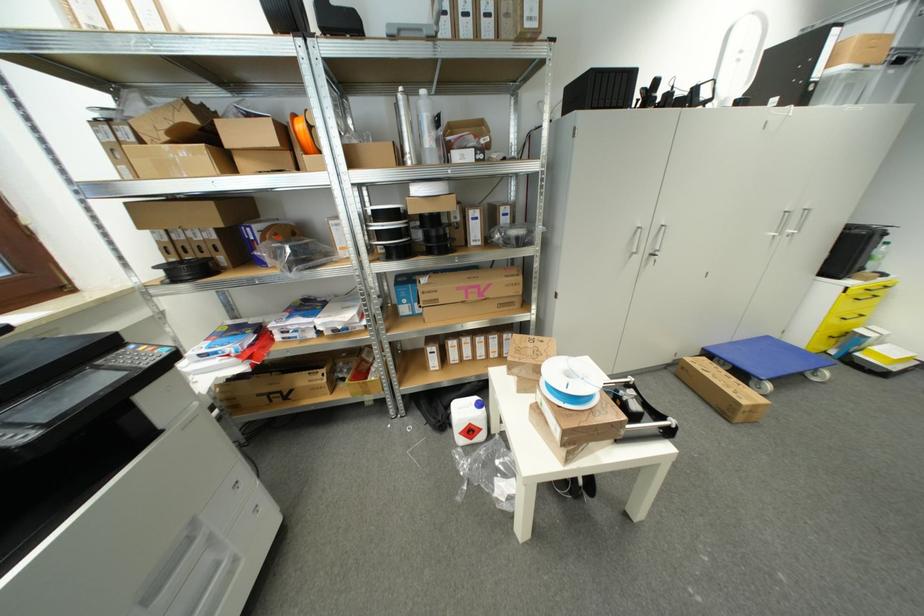
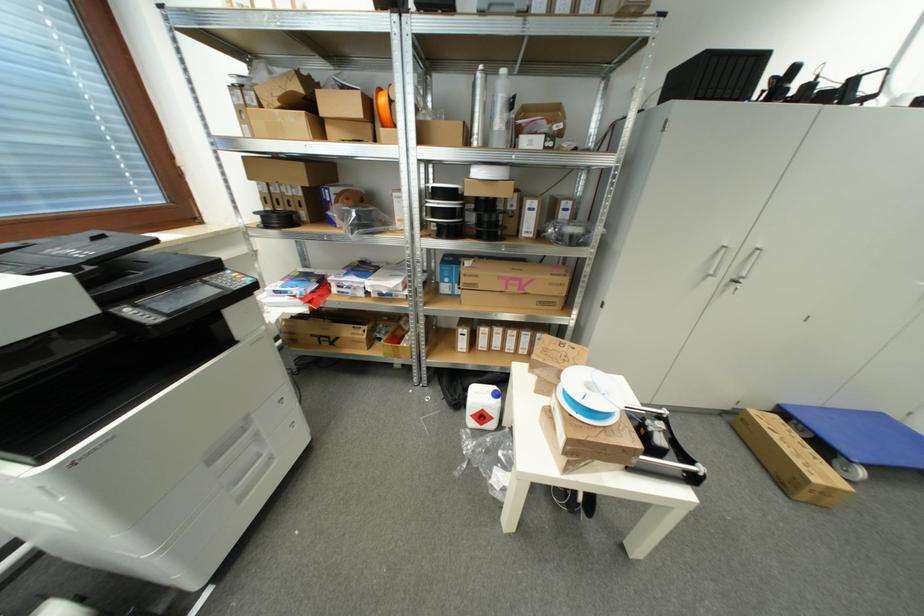
Find the pixel in the second image that matches [383,237] in the first image.

(439, 215)